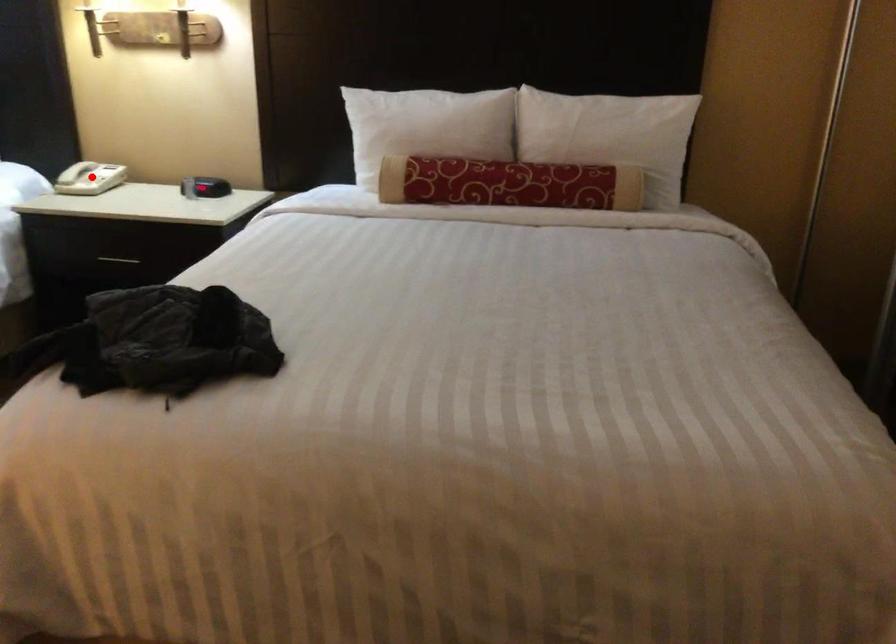
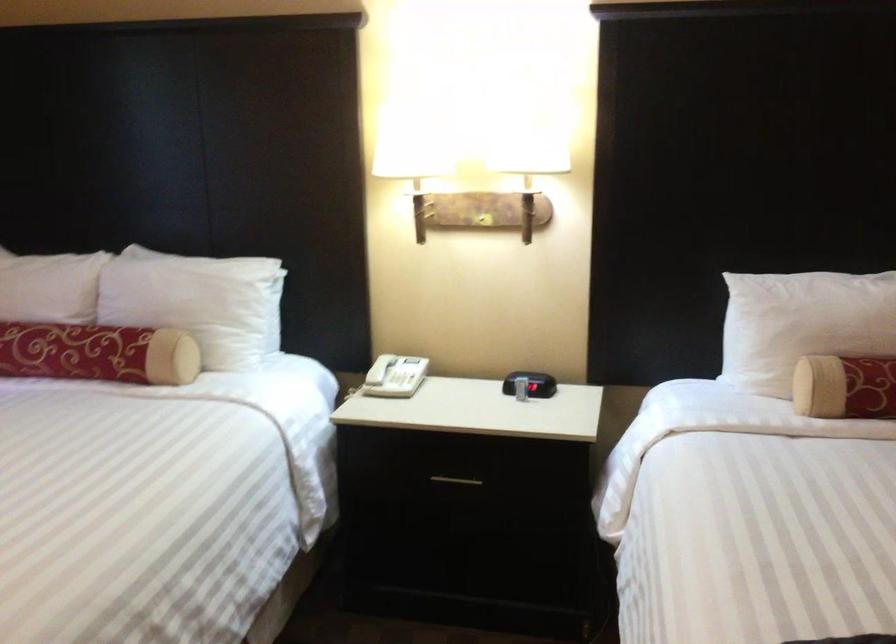
Question: I am providing you with two images of the same scene from different viewpoints. A red point is marked on the first image. At the location where the point appears in image 1, is it still visible in image 2?

Choices:
 (A) Yes
 (B) No

Answer: (A)